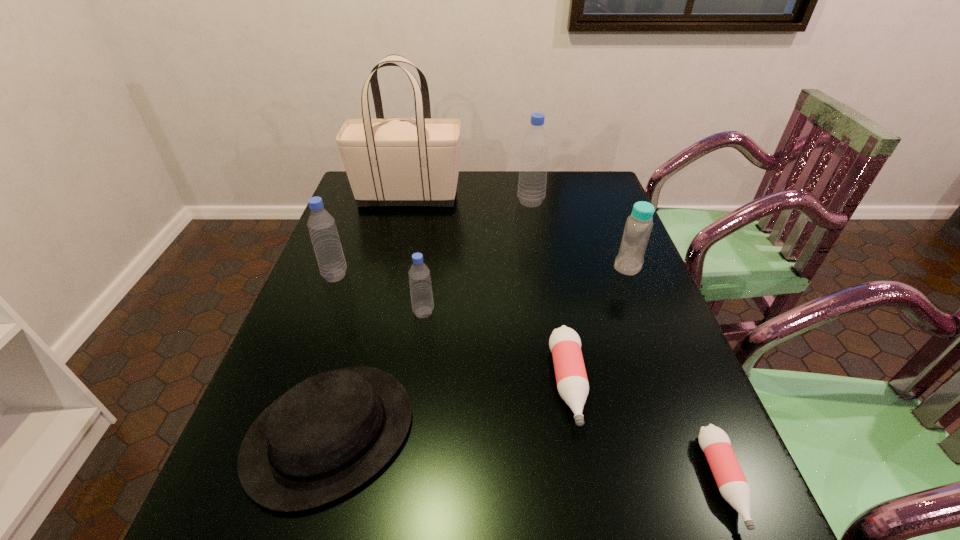
Locate an element on the screen. Image resolution: width=960 pixels, height=540 pixels. vacant region between the leftmost blue bottle and the tallest bottle is located at coordinates (433, 239).

I want to click on empty location between the rightmost blue bottle and the fifth tallest bottle, so click(x=598, y=325).

Where is `unoccupied position between the third blue bottle from left to right and the fourth farthest bottle`? unoccupied position between the third blue bottle from left to right and the fourth farthest bottle is located at coordinates (477, 257).

Where is `free area in between the second shortest bottle and the sixth tallest object`? free area in between the second shortest bottle and the sixth tallest object is located at coordinates (449, 408).

Locate an element on the screen. free spot between the smaller pink bottle and the fedora is located at coordinates (527, 457).

Locate an element on the screen. object that is the sixth closest to the farthest blue bottle is located at coordinates (326, 436).

Select which object appears as the sixth closest to the farthest bottle. Please provide its 2D coordinates. Your answer should be formatted as a tuple, i.e. [(x, y)], where the tuple contains the x and y coordinates of a point satisfying the conditions above.

[(326, 436)]

Identify the location of bottle that is the second closest to the biggest blue bottle. This screenshot has width=960, height=540. (421, 293).

Select which bottle is the fourth closest to the smaller pink bottle. Please provide its 2D coordinates. Your answer should be formatted as a tuple, i.e. [(x, y)], where the tuple contains the x and y coordinates of a point satisfying the conditions above.

[(531, 192)]

At what (x,y) coordinates should I click in order to perform the action: click on blue bottle identified as the third closest to the tallest object. Please return your answer as a coordinate pair (x, y). The width and height of the screenshot is (960, 540). Looking at the image, I should click on (421, 293).